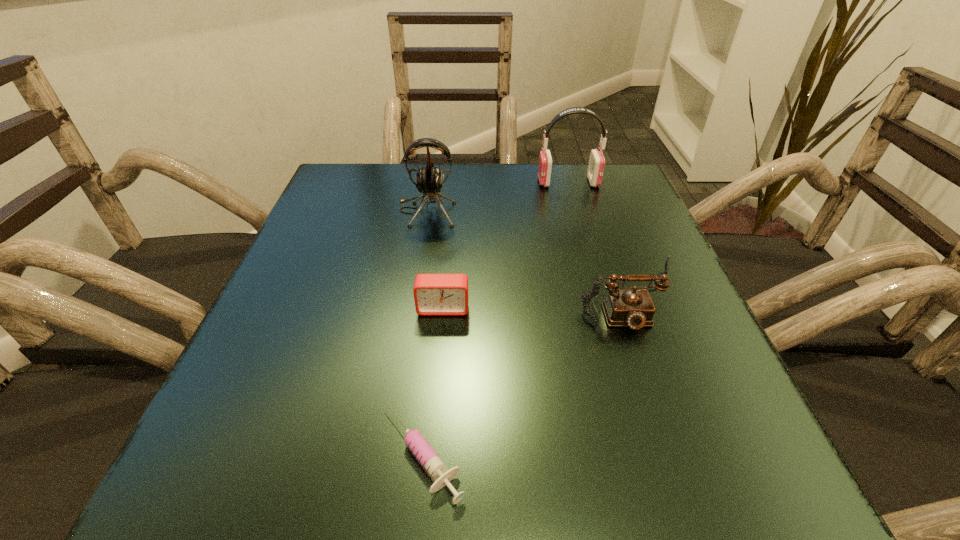
The image size is (960, 540). In order to click on vacant space at the left edge of the desktop in this screenshot , I will do `click(250, 437)`.

This screenshot has height=540, width=960. I want to click on vacant space at the right edge of the desktop, so click(x=655, y=388).

Where is `vacant position at the far left corner of the desktop`? The height and width of the screenshot is (540, 960). vacant position at the far left corner of the desktop is located at coordinates (364, 205).

I want to click on vacant position at the near right corner of the desktop, so click(674, 447).

Where is `vacant space that's between the telephone and the nearest object`? The width and height of the screenshot is (960, 540). vacant space that's between the telephone and the nearest object is located at coordinates (526, 373).

The height and width of the screenshot is (540, 960). In order to click on vacant area that lies between the left earphone and the third shortest object in this screenshot , I will do `click(529, 252)`.

In order to click on free space that is in between the farthest object and the nearest object in this screenshot , I will do `click(495, 318)`.

Identify the location of vacant point located between the syringe and the second shortest object. The image size is (960, 540). (432, 380).

Find the location of a particular element. This screenshot has height=540, width=960. free space between the left earphone and the right earphone is located at coordinates (497, 197).

Locate an element on the screen. The image size is (960, 540). vacant region between the farthest object and the second shortest object is located at coordinates (506, 245).